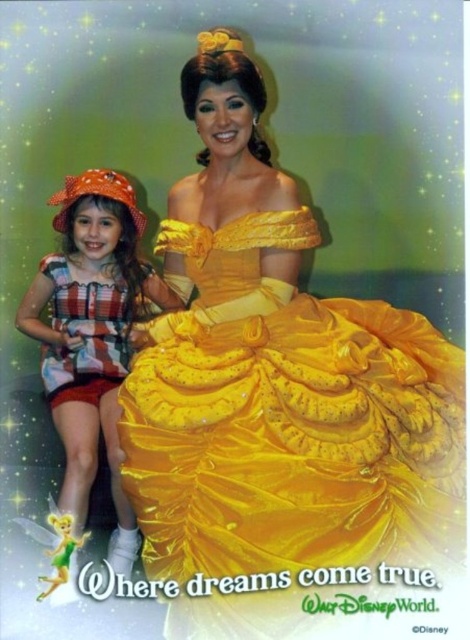
You are a photographer setting up a photo shoot with two models wearing the shiny yellow dress at center and the striped fabric dress at left. Based on their heights, which model should stand in the back to avoid blocking the other?

The shiny yellow dress at center is much taller than the striped fabric dress at left, so the model wearing the shiny yellow dress at center should stand in the back to avoid blocking the shorter model.

You are a photographer trying to capture a clear photo of the shiny yellow dress at center and the striped fabric dress at left. Which dress should you focus on first to ensure it appears sharp in the photo?

→ The shiny yellow dress at center should be focused on first because it is in front of the striped fabric dress at left, so focusing on the closer object will ensure it appears sharp while the background may blur slightly.

You are standing in front of the two costumed individuals and want to take a photo. You notice two specific points marked as point 1 at coordinates point (211, 380) and point 2 at coordinates point (87, 483). Which point is closer to you?

Point (211, 380) is in front of point (87, 483), so point (211, 380) is closer to you.